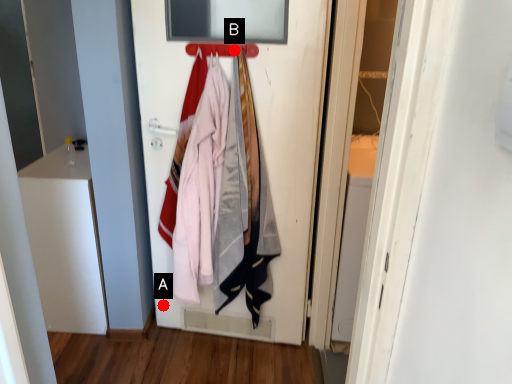
Question: Two points are circled on the image, labeled by A and B beside each circle. Among these points, which one is farthest from the camera?

Choices:
 (A) A is further
 (B) B is further

Answer: (A)